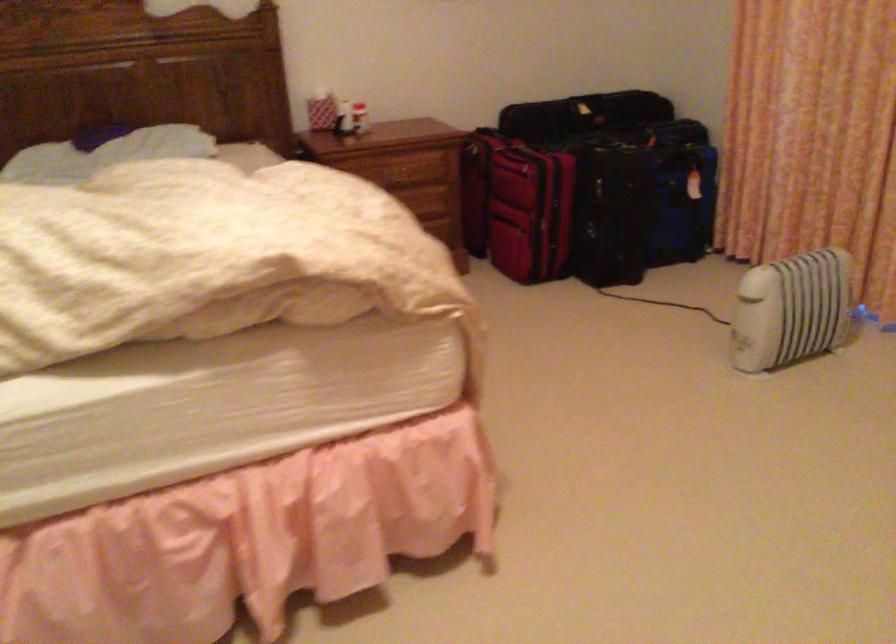
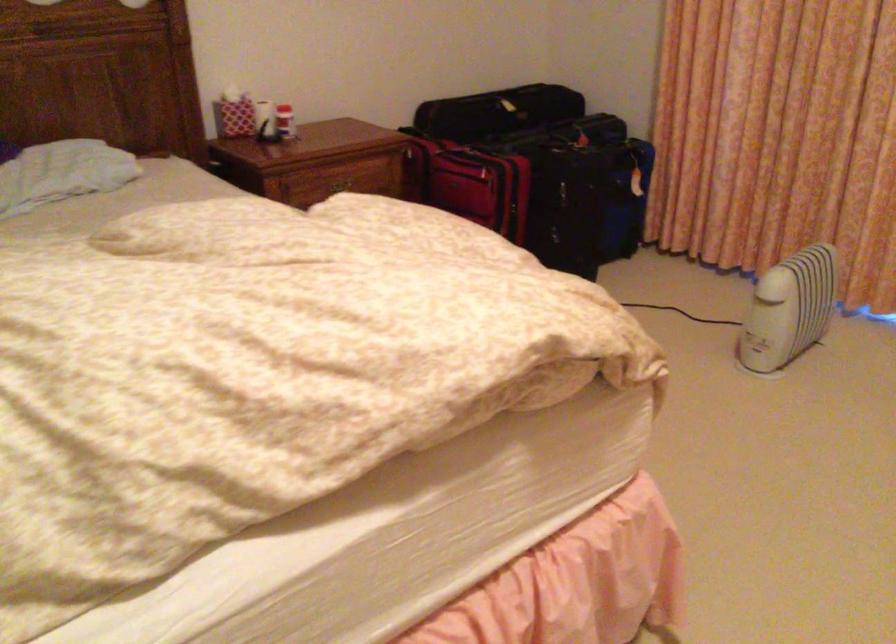
Where in the second image is the point corresponding to pixel 708 230 from the first image?

(649, 223)